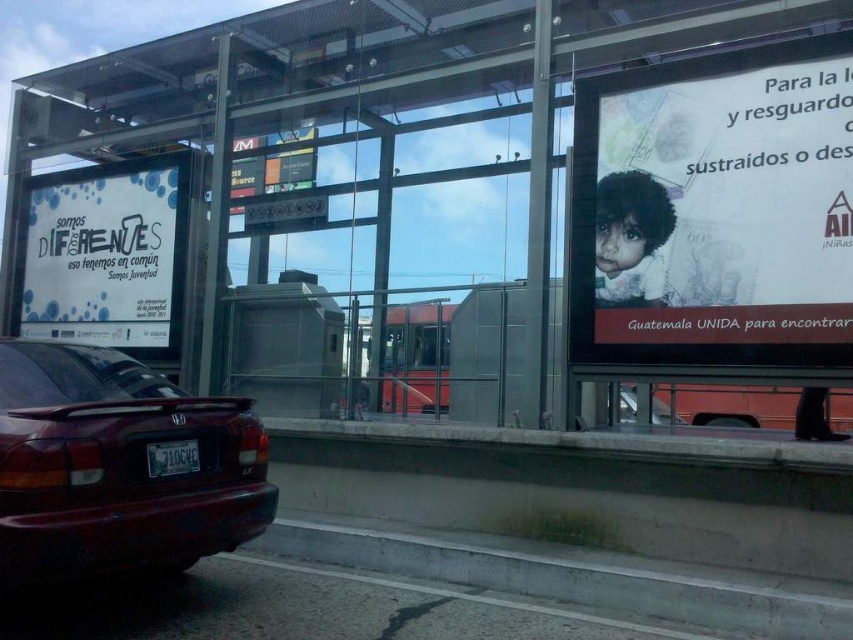
Between point (128, 305) and point (256, 140), which one is positioned in front?

Point (128, 305)

The height and width of the screenshot is (640, 853). Identify the location of white paper billboard at left. (107, 253).

The height and width of the screenshot is (640, 853). Identify the location of white paper billboard at left. (107, 253).

Which of these two, glossy red car at lower left or green metallic license plate at lower left, stands shorter?

green metallic license plate at lower left is shorter.

Who is more forward, (238, 435) or (155, 460)?

Positioned in front is point (155, 460).

At what (x,y) coordinates should I click in order to perform the action: click on glossy red car at lower left. Please return your answer as a coordinate pair (x, y). The width and height of the screenshot is (853, 640). Looking at the image, I should click on (115, 467).

Locate an element on the screen. white glossy poster at upper right is located at coordinates (715, 209).

Is white glossy poster at upper right to the right of matte digital display at center from the viewer's perspective?

Yes, white glossy poster at upper right is to the right of matte digital display at center.

Who is more distant from viewer, (715, 333) or (299, 160)?

Point (299, 160)

Locate an element on the screen. Image resolution: width=853 pixels, height=640 pixels. white glossy poster at upper right is located at coordinates (715, 209).